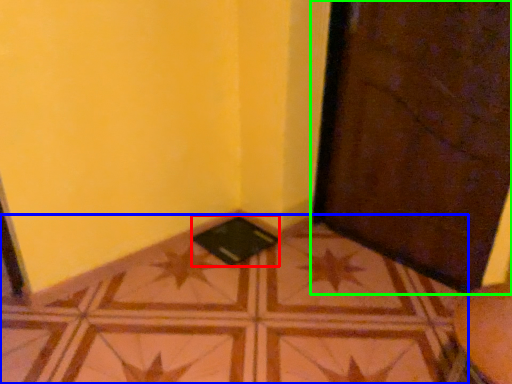
Question: Which object is the closest to the pad (highlighted by a red box)? Choose among these: tile (highlighted by a blue box) or door (highlighted by a green box).

Choices:
 (A) tile
 (B) door

Answer: (A)